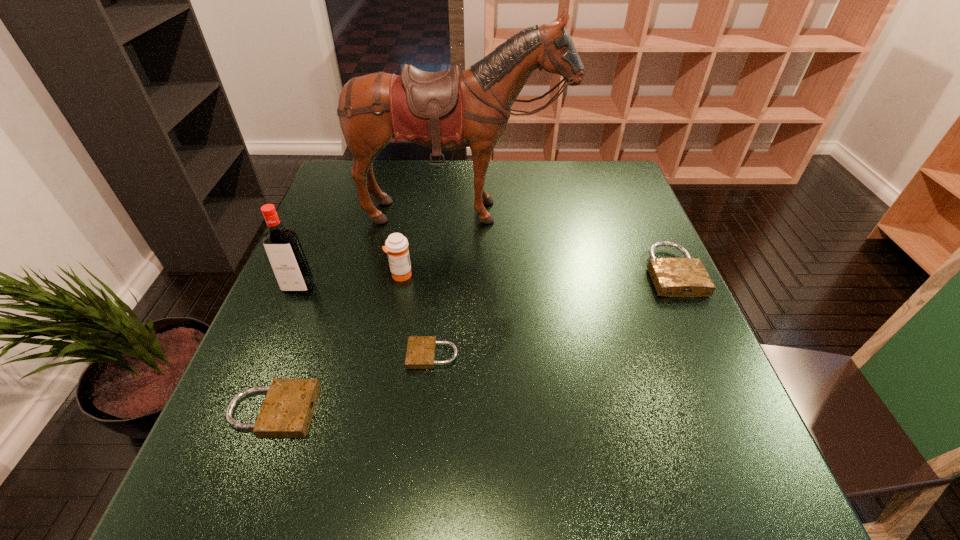
Image resolution: width=960 pixels, height=540 pixels. I want to click on vacant position located on the keyhole side of the leftmost padlock, so click(x=441, y=411).

You are a GUI agent. You are given a task and a screenshot of the screen. Output one action in this format:
    pyautogui.click(x=<x>, y=<y>)
    Task: Click on the vacant space located on the keyhole side of the second padlock from right to left
    
    Given the screenshot: What is the action you would take?
    pyautogui.click(x=353, y=355)

Find the location of a particular element. The height and width of the screenshot is (540, 960). vacant area situated on the keyhole side of the second padlock from right to left is located at coordinates (344, 355).

Locate an element on the screen. The width and height of the screenshot is (960, 540). free spot located on the keyhole side of the second padlock from right to left is located at coordinates (333, 355).

This screenshot has height=540, width=960. I want to click on vacant space located 0.150m on the keyhole side of the farthest padlock, so click(708, 351).

This screenshot has width=960, height=540. In order to click on vacant point located on the back of the saddle in this screenshot , I will do pyautogui.click(x=455, y=350).

Image resolution: width=960 pixels, height=540 pixels. I want to click on vacant space located on the right of the medicine, so click(450, 274).

At what (x,y) coordinates should I click in order to perform the action: click on free spot located 0.140m on the front and back of the fifth shortest object. Please return your answer as a coordinate pair (x, y). Looking at the image, I should click on [x=276, y=346].

This screenshot has width=960, height=540. Find the location of `object that is at the far edge`. object that is at the far edge is located at coordinates pyautogui.click(x=448, y=110).

Locate an element on the screen. object situated at the near edge is located at coordinates (288, 407).